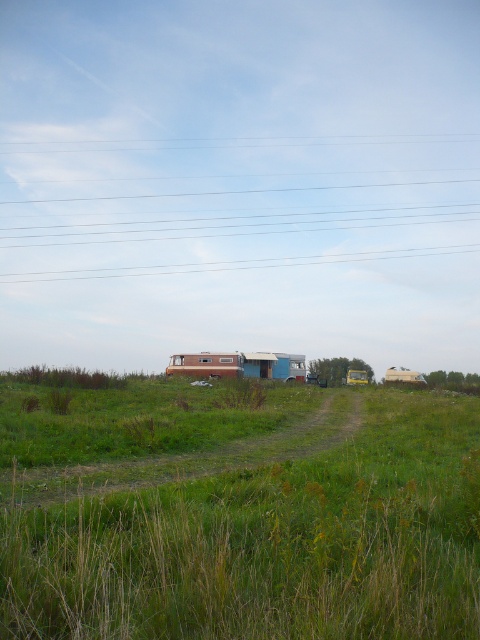
You are a bird flying over the rural field. You notice the transparent wire at upper center and the brown wood cabin at center. Which object is taller from your perspective?

The transparent wire at upper center is taller than the brown wood cabin at center.

You are a hiker who needs to cross the field to reach the brown wood cabin at center. There is a transparent wire at upper center that you must avoid. Given that you can walk in a straight line, will you be able to reach the cabin without getting too close to the wire?

The transparent wire at upper center and brown wood cabin at center are 67.29 meters apart from each other. Since you can walk in a straight line, you can reach the brown wood cabin at center without getting too close to the transparent wire at upper center as long as you maintain a safe distance during your path.